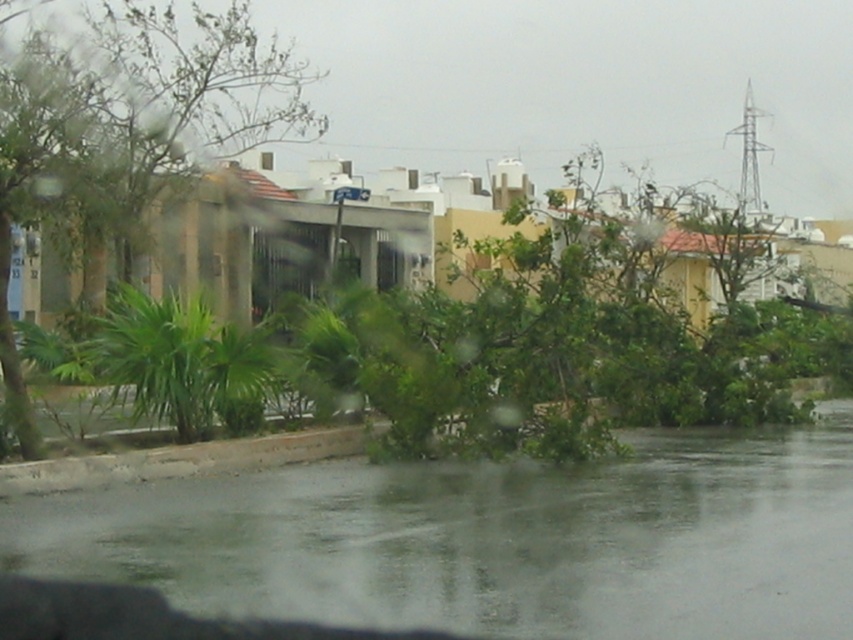
You are driving a car and want to avoid hitting a pothole. You see the clear water at lower center and the green leafy tree at left. Which object is closer to your car?

The clear water at lower center is closer to the car because it is only 14.86 meters away from the green leafy tree at left, and since you are in the driver seat, the water is in front of you while the tree is further to the side.

You are driving a car and want to know if the distance between the two points marked as point (535, 580) is enough to make a U turn. The car requires 10 meters to turn. Can you do it?

The distance between the two points marked as point (535, 580) is 9.77 meters, which is less than the required 10 meters for the car to turn. Therefore, you cannot make a U turn safely.

Looking at this image, you are driving a car and notice the clear water at lower center on the road ahead. Based on its position, can you estimate whether it is in a safe area to drive through?

The clear water at lower center is located at point coordinates, so it is in a safe area to drive through.